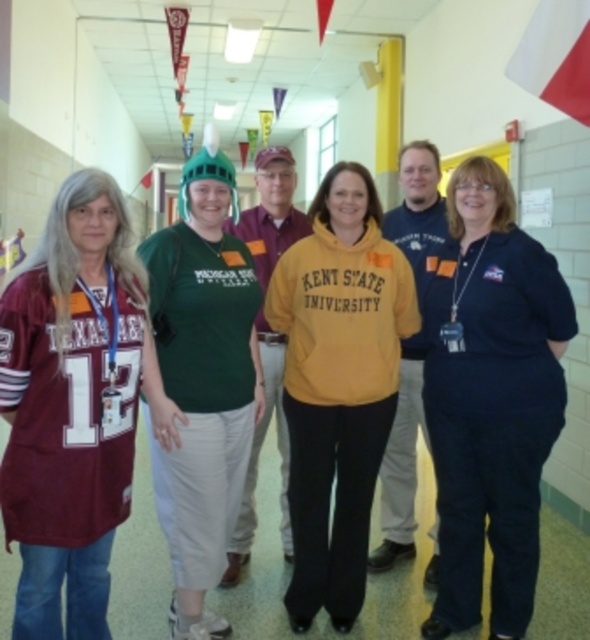
Question: Estimate the real-world distances between objects in this image. Which object is closer to the yellow fleece sweatshirt at center?

Choices:
 (A) maroon fabric shirt at center
 (B) yellow fleece at center
 (C) white fabric flag at upper right
 (D) maroon jersey at left

Answer: (A)

Question: Does maroon fabric shirt at center appear under white fabric flag at upper right?

Choices:
 (A) yes
 (B) no

Answer: (A)

Question: Which point is closer to the camera taking this photo?

Choices:
 (A) (565, 109)
 (B) (516, 470)
 (C) (352, 333)

Answer: (B)

Question: Does green matte helmet at center come in front of maroon fabric shirt at center?

Choices:
 (A) no
 (B) yes

Answer: (B)

Question: Estimate the real-world distances between objects in this image. Which object is closer to the yellow fleece at center?

Choices:
 (A) yellow fleece sweatshirt at center
 (B) white fabric flag at upper right
 (C) green matte helmet at center
 (D) maroon jersey at left

Answer: (A)

Question: Is green matte helmet at center further to camera compared to yellow fleece at center?

Choices:
 (A) no
 (B) yes

Answer: (A)